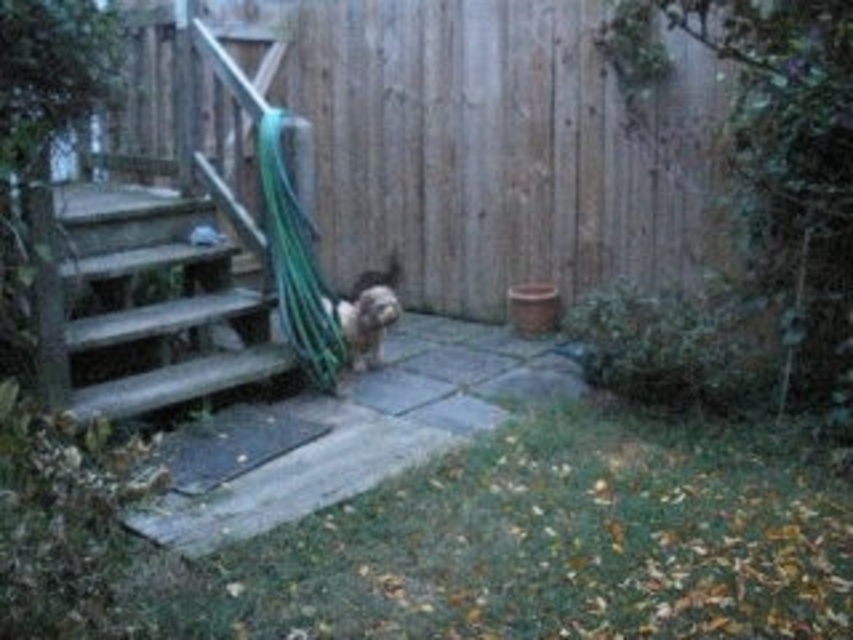
You are standing at the bottom of the wooden stairs at left and want to walk towards the wooden fence at center. Which direction should you face to head directly towards it?

You should face to the right to head directly towards the wooden fence at center, since it is located to the right of the wooden stairs at left.

You are a gardener who needs to water the plants near the fuzzy brown dog at center. The green rubber hose at center is your only water source. Can you reach the dog with the hose without moving either the hose or the dog?

The green rubber hose at center is 11.53 inches from the fuzzy brown dog at center. Since the distance is very short, the hose can easily reach the dog without needing to move either.

You are standing in the garden and want to walk from the wooden fence at center to the fuzzy brown dog at center. Is there enough space between them for you to pass through comfortably?

The wooden fence at center might be wider than fuzzy brown dog at center, so there may not be enough space to pass through comfortably between them. You should consider going around instead.